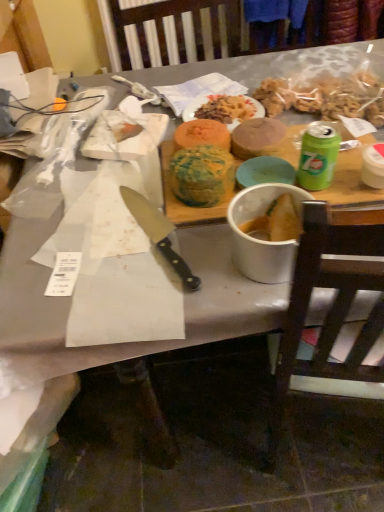
Question: Does white matte bowl at center have a smaller size compared to brown wooden chair at right?

Choices:
 (A) yes
 (B) no

Answer: (A)

Question: Does white matte bowl at center have a lesser width compared to brown wooden chair at right?

Choices:
 (A) yes
 (B) no

Answer: (A)

Question: From the image's perspective, is white matte bowl at center on top of brown wooden chair at right?

Choices:
 (A) no
 (B) yes

Answer: (B)

Question: Is white matte bowl at center further to the viewer compared to brown wooden chair at right?

Choices:
 (A) yes
 (B) no

Answer: (A)

Question: From the image's perspective, is white matte bowl at center beneath brown wooden chair at right?

Choices:
 (A) yes
 (B) no

Answer: (B)

Question: Considering the positions of black plastic knife at center and green and yellow cake at center, placed as the 1th food when sorted from left to right, in the image, is black plastic knife at center taller or shorter than green and yellow cake at center, placed as the 1th food when sorted from left to right,?

Choices:
 (A) short
 (B) tall

Answer: (A)

Question: Considering the relative positions of black plastic knife at center and green and yellow cake at center, placed as the 1th food when sorted from left to right, in the image provided, is black plastic knife at center to the left or to the right of green and yellow cake at center, placed as the 1th food when sorted from left to right,?

Choices:
 (A) right
 (B) left

Answer: (B)

Question: Is point (134, 203) positioned closer to the camera than point (183, 200)?

Choices:
 (A) closer
 (B) farther

Answer: (B)

Question: Looking at the image, does black plastic knife at center seem bigger or smaller compared to green and yellow cake at center, the third food viewed from the right?

Choices:
 (A) big
 (B) small

Answer: (B)

Question: Considering the positions of smooth brown cake at center, the 3th food when ordered from left to right, and brown wooden chair at right in the image, is smooth brown cake at center, the 3th food when ordered from left to right, taller or shorter than brown wooden chair at right?

Choices:
 (A) short
 (B) tall

Answer: (A)

Question: Is point (264, 154) closer or farther from the camera than point (306, 259)?

Choices:
 (A) farther
 (B) closer

Answer: (A)

Question: From the image's perspective, relative to brown wooden chair at right, is smooth brown cake at center, the 1th food when ordered from right to left, above or below?

Choices:
 (A) below
 (B) above

Answer: (B)

Question: In terms of width, does smooth brown cake at center, the 1th food when ordered from right to left, look wider or thinner when compared to brown wooden chair at right?

Choices:
 (A) thin
 (B) wide

Answer: (A)

Question: Choose the correct answer: Is matte orange plate at center inside black plastic knife at center or outside it?

Choices:
 (A) inside
 (B) outside

Answer: (B)

Question: Based on their sizes in the image, would you say matte orange plate at center is bigger or smaller than black plastic knife at center?

Choices:
 (A) big
 (B) small

Answer: (A)